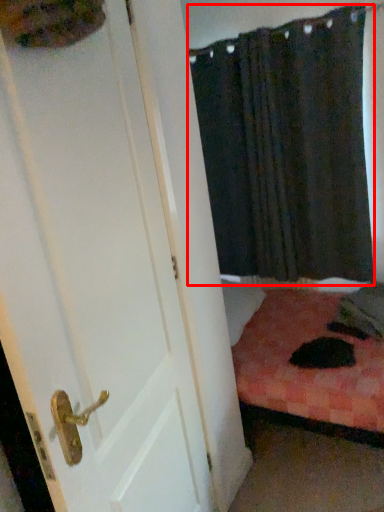
Question: From the image's perspective, considering the relative positions of curtain (annotated by the red box) and door in the image provided, where is curtain (annotated by the red box) located with respect to the staircase?

Choices:
 (A) above
 (B) below

Answer: (A)